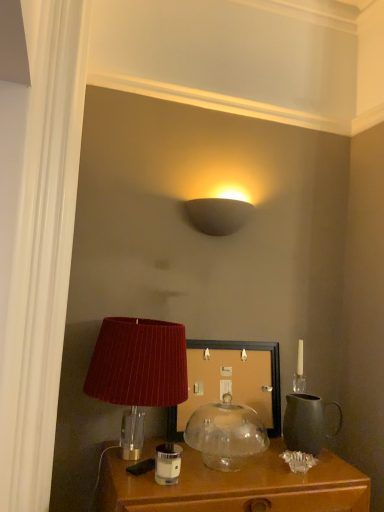
Question: Which direction should I rotate to look at matte gray wall sconce at upper center, marked as the 3th lamp in a bottom-to-top arrangement, — up or down?

Choices:
 (A) up
 (B) down

Answer: (A)

Question: Is matte wooden picture frame at center positioned with its back to clear glass candle holder at lower center?

Choices:
 (A) yes
 (B) no

Answer: (B)

Question: From a real-world perspective, is matte wooden picture frame at center located higher than clear glass candle holder at lower center?

Choices:
 (A) no
 (B) yes

Answer: (B)

Question: Is matte wooden picture frame at center in front of clear glass candle holder at lower center?

Choices:
 (A) yes
 (B) no

Answer: (B)

Question: Is clear glass candle holder at lower center located within matte wooden picture frame at center?

Choices:
 (A) yes
 (B) no

Answer: (B)

Question: Is matte wooden picture frame at center far from clear glass candle holder at lower center?

Choices:
 (A) no
 (B) yes

Answer: (A)

Question: Is matte wooden picture frame at center facing towards clear glass candle holder at lower center?

Choices:
 (A) yes
 (B) no

Answer: (A)

Question: Does matte black pitcher at right have a larger size compared to matte gray wall sconce at upper center, placed as the 1th lamp when sorted from top to bottom?

Choices:
 (A) yes
 (B) no

Answer: (B)

Question: Considering the relative sizes of matte black pitcher at right and matte gray wall sconce at upper center, placed as the 1th lamp when sorted from top to bottom, in the image provided, is matte black pitcher at right smaller than matte gray wall sconce at upper center, placed as the 1th lamp when sorted from top to bottom,?

Choices:
 (A) no
 (B) yes

Answer: (B)

Question: Can you confirm if matte black pitcher at right is positioned to the right of matte gray wall sconce at upper center, placed as the 1th lamp when sorted from top to bottom?

Choices:
 (A) no
 (B) yes

Answer: (B)

Question: Is matte black pitcher at right oriented away from matte gray wall sconce at upper center, marked as the 3th lamp in a bottom-to-top arrangement?

Choices:
 (A) yes
 (B) no

Answer: (B)

Question: Can you confirm if matte black pitcher at right is taller than matte gray wall sconce at upper center, placed as the 1th lamp when sorted from top to bottom?

Choices:
 (A) yes
 (B) no

Answer: (A)

Question: Does matte black pitcher at right appear on the left side of matte gray wall sconce at upper center, placed as the 1th lamp when sorted from top to bottom?

Choices:
 (A) no
 (B) yes

Answer: (A)

Question: From a real-world perspective, is matte wooden picture frame at center located beneath transparent glass dome at center, the 3th lamp when ordered from top to bottom?

Choices:
 (A) yes
 (B) no

Answer: (B)